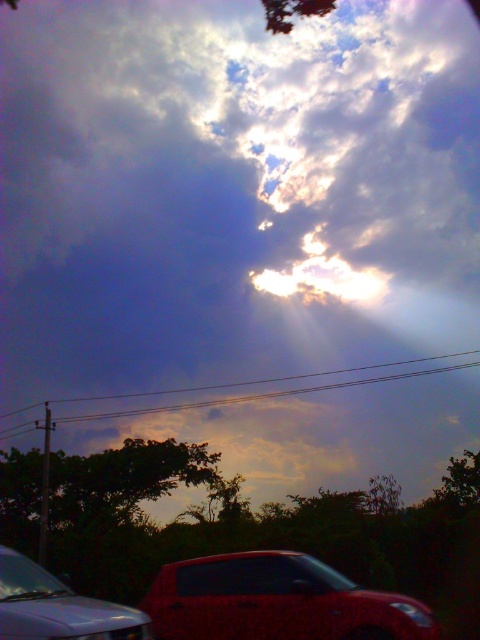
Who is higher up, glossy metallic car at lower center or metallic red car at lower left?

Positioned higher is metallic red car at lower left.

Does glossy metallic car at lower center appear over metallic red car at lower left?

No.

Describe the element at coordinates (276, 602) in the screenshot. I see `glossy metallic car at lower center` at that location.

This screenshot has width=480, height=640. I want to click on glossy metallic car at lower center, so click(276, 602).